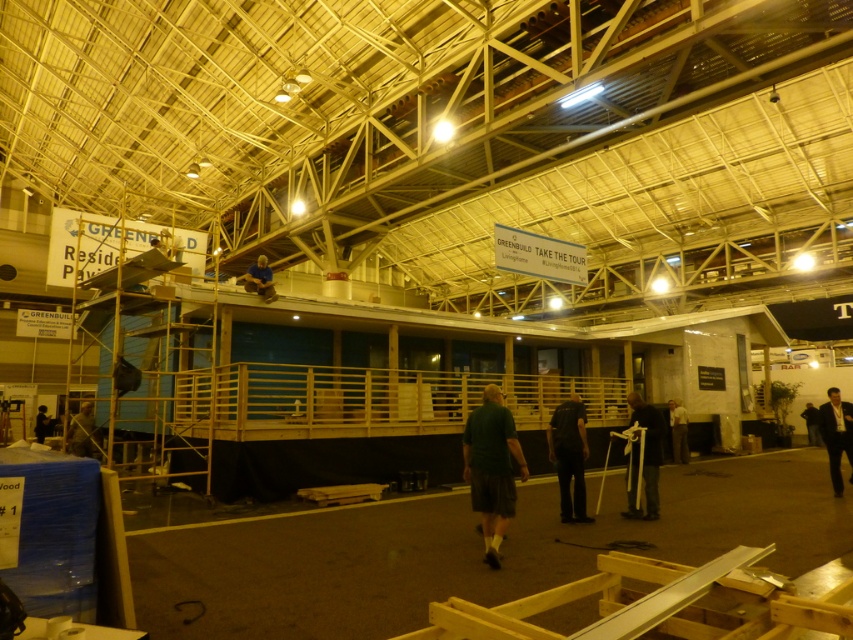
You are an event organizer trying to set up a walking path for attendees. You have the white plastic crutches at center and the dark gray fabric pants at lower right in your view. Which object is located to the left when looking from the front of the scene?

The white plastic crutches at center is positioned on the left side of dark gray fabric pants at lower right, so it is located to the left when looking from the front of the scene.

You are an event organizer who needs to ensure safety in the construction area. You notice two people wearing green clothing in the scene. The first is wearing a green matte shirt at center, and the second is a green fabric person at lower left. Which of these two individuals is closer to the partially constructed wooden structure?

The green fabric person at lower left is closer to the partially constructed wooden structure because they are positioned at the lower left, which is typically closer to the base of the structure compared to the green matte shirt at center who might be on a higher level.

You are standing in the convention center and see the dark suit at lower right and the dark gray fabric pants at lower right. Which one is nearer to you?

The dark suit at lower right is closer to the viewer than the dark gray fabric pants at lower right.